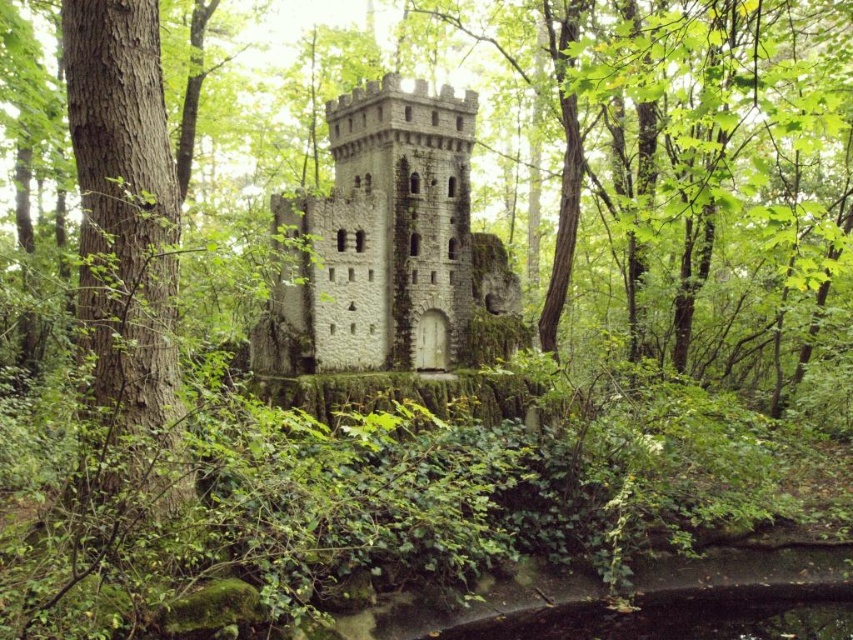
Between stone tower at center and brown rough bark tree at left, which one is positioned higher?

Positioned higher is stone tower at center.

Who is positioned more to the right, stone tower at center or brown rough bark tree at left?

From the viewer's perspective, stone tower at center appears more on the right side.

In order to click on stone tower at center in this screenshot , I will do `click(386, 244)`.

The width and height of the screenshot is (853, 640). I want to click on stone tower at center, so click(x=386, y=244).